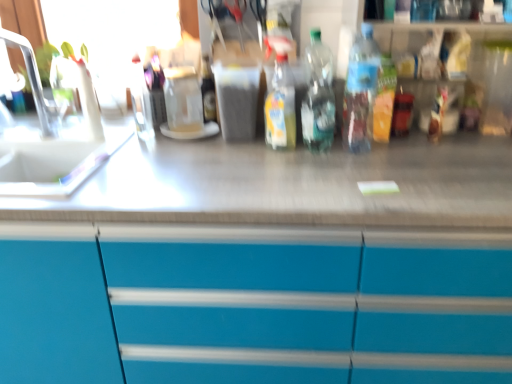
Question: From a real-world perspective, is translucent plastic bottle at center, which is the 2th bottle from left to right, physically below white plastic faucet at left?

Choices:
 (A) yes
 (B) no

Answer: (A)

Question: Considering the relative sizes of translucent plastic bottle at center, which is the 2th bottle from left to right, and white plastic faucet at left in the image provided, is translucent plastic bottle at center, which is the 2th bottle from left to right, bigger than white plastic faucet at left?

Choices:
 (A) no
 (B) yes

Answer: (A)

Question: Can you confirm if translucent plastic bottle at center, which is the 2th bottle from left to right, is shorter than white plastic faucet at left?

Choices:
 (A) no
 (B) yes

Answer: (B)

Question: Is translucent plastic bottle at center, the 3th bottle positioned from the right, not near white plastic faucet at left?

Choices:
 (A) no
 (B) yes

Answer: (A)

Question: Does translucent plastic bottle at center, which is the 2th bottle from left to right, lie behind white plastic faucet at left?

Choices:
 (A) no
 (B) yes

Answer: (B)

Question: Considering the positions of transparent plastic bottle at center, which ranks as the second bottle in right-to-left order, and translucent plastic bottle at center, positioned as the 1th bottle in right-to-left order, in the image, is transparent plastic bottle at center, which ranks as the second bottle in right-to-left order, bigger or smaller than translucent plastic bottle at center, positioned as the 1th bottle in right-to-left order,?

Choices:
 (A) small
 (B) big

Answer: (A)

Question: Do you think transparent plastic bottle at center, which ranks as the second bottle in right-to-left order, is within translucent plastic bottle at center, which ranks as the fourth bottle in left-to-right order, or outside of it?

Choices:
 (A) inside
 (B) outside

Answer: (B)

Question: Considering the relative positions of transparent plastic bottle at center, positioned as the third bottle in left-to-right order, and translucent plastic bottle at center, which ranks as the fourth bottle in left-to-right order, in the image provided, is transparent plastic bottle at center, positioned as the third bottle in left-to-right order, to the left or to the right of translucent plastic bottle at center, which ranks as the fourth bottle in left-to-right order,?

Choices:
 (A) right
 (B) left

Answer: (B)

Question: Considering their positions, is transparent plastic bottle at center, positioned as the third bottle in left-to-right order, located in front of or behind translucent plastic bottle at center, which ranks as the fourth bottle in left-to-right order?

Choices:
 (A) behind
 (B) front

Answer: (A)

Question: Is transparent glass jar at center wider or thinner than white plastic faucet at left?

Choices:
 (A) wide
 (B) thin

Answer: (B)

Question: Visually, is transparent glass jar at center positioned to the left or to the right of white plastic faucet at left?

Choices:
 (A) left
 (B) right

Answer: (B)

Question: Considering the positions of transparent glass jar at center and white plastic faucet at left in the image, is transparent glass jar at center taller or shorter than white plastic faucet at left?

Choices:
 (A) tall
 (B) short

Answer: (B)

Question: From the image's perspective, relative to white plastic faucet at left, is transparent glass jar at center above or below?

Choices:
 (A) below
 (B) above

Answer: (B)

Question: Relative to white plastic faucet at left, is transparent plastic bottle at center, positioned as the third bottle in left-to-right order, in front or behind?

Choices:
 (A) behind
 (B) front

Answer: (A)

Question: From the image's perspective, relative to white plastic faucet at left, is transparent plastic bottle at center, positioned as the third bottle in left-to-right order, above or below?

Choices:
 (A) above
 (B) below

Answer: (B)